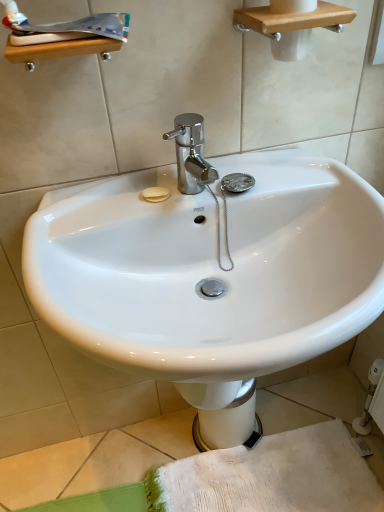
Question: Based on their positions, is white glossy toothpaste at upper left located to the left or right of white glossy bidet at center?

Choices:
 (A) right
 (B) left

Answer: (B)

Question: Is white glossy toothpaste at upper left taller or shorter than white glossy bidet at center?

Choices:
 (A) tall
 (B) short

Answer: (B)

Question: Estimate the real-world distances between objects in this image. Which object is farther from the white glossy bidet at center?

Choices:
 (A) white glossy toothpaste at upper left
 (B) white glossy sink at center

Answer: (A)

Question: Which is farther from the white glossy toothpaste at upper left?

Choices:
 (A) white glossy sink at center
 (B) white glossy bidet at center

Answer: (B)